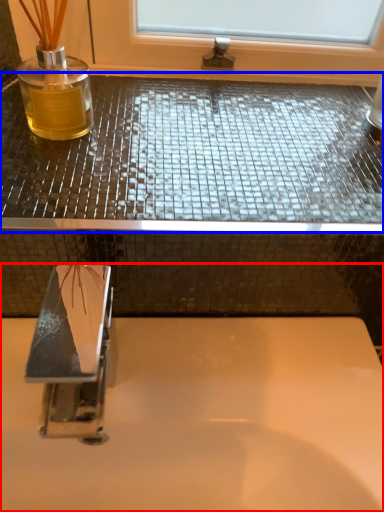
Question: Which object appears farthest to the camera in this image, sink (highlighted by a red box) or counter top (highlighted by a blue box)?

Choices:
 (A) sink
 (B) counter top

Answer: (B)